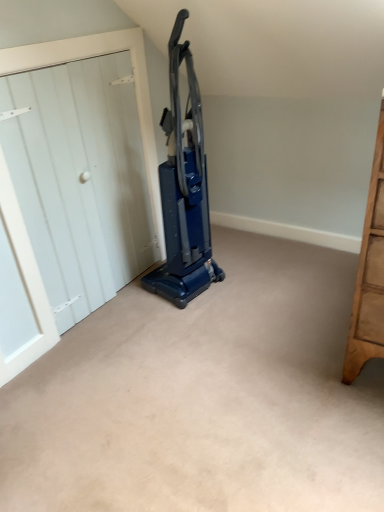
Question: From the image's perspective, is blue plastic vacuum cleaner at center above or below white wood door at left?

Choices:
 (A) below
 (B) above

Answer: (B)

Question: From a real-world perspective, relative to white wood door at left, is blue plastic vacuum cleaner at center vertically above or below?

Choices:
 (A) above
 (B) below

Answer: (A)

Question: Do you think blue plastic vacuum cleaner at center is within white wood door at left, or outside of it?

Choices:
 (A) inside
 (B) outside

Answer: (B)

Question: From the image's perspective, relative to blue plastic vacuum cleaner at center, is white wood door at left above or below?

Choices:
 (A) above
 (B) below

Answer: (B)

Question: In terms of size, does white wood door at left appear bigger or smaller than blue plastic vacuum cleaner at center?

Choices:
 (A) small
 (B) big

Answer: (A)

Question: Considering their positions, is white wood door at left located in front of or behind blue plastic vacuum cleaner at center?

Choices:
 (A) front
 (B) behind

Answer: (A)

Question: Is white wood door at left spatially inside blue plastic vacuum cleaner at center, or outside of it?

Choices:
 (A) outside
 (B) inside

Answer: (A)